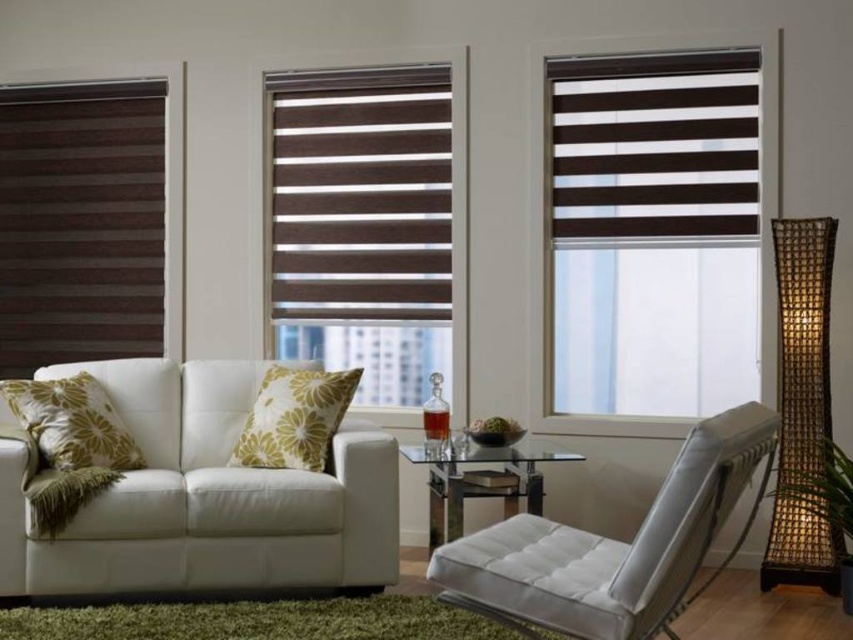
You are standing in the living room and want to place a new plant pot between the two points, point (x=701, y=157) and point (x=115, y=520). Based on their positions, which point should the plant pot be closer to if it needs to be placed in front of the sofa?

The plant pot should be closer to point (x=115, y=520) because point (x=701, y=157) is behind point (x=115, y=520), so placing it near the front point would keep it in front of the sofa.

In the scene shown: You are planning to place a new decorative item on the largest object between the white leather armchair at lower right and the green floral pillow at left. Which object should you choose?

The white leather armchair at lower right is larger than the green floral pillow at left, so you should place the decorative item on the white leather armchair at lower right.